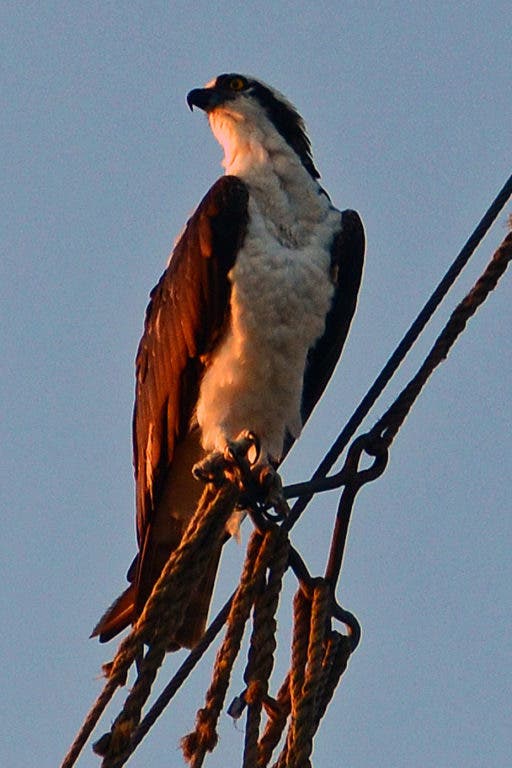
Locate an element on the screen. The width and height of the screenshot is (512, 768). cable is located at coordinates (409, 335), (185, 676).